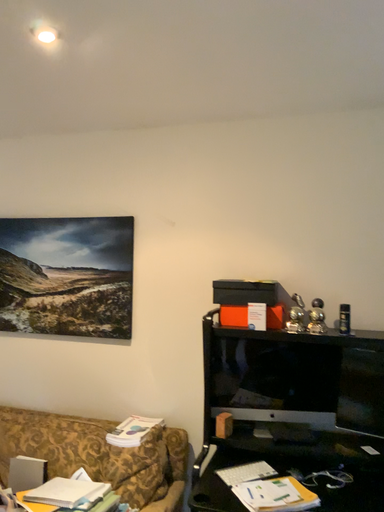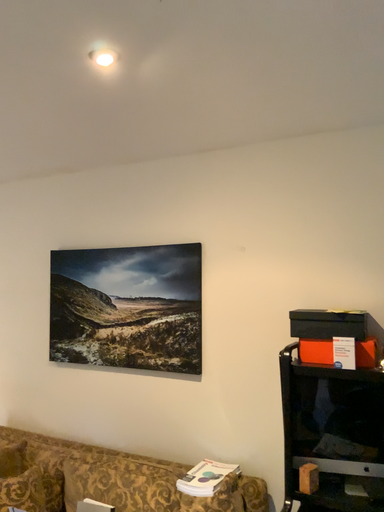
Question: How did the camera likely rotate when shooting the video?

Choices:
 (A) rotated left
 (B) rotated right

Answer: (A)